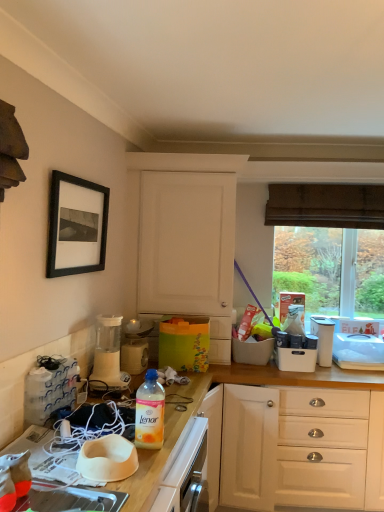
Question: Is black matte picture frame at upper left spatially inside translucent plastic bottle at lower center, or outside of it?

Choices:
 (A) inside
 (B) outside

Answer: (B)

Question: In the image, is black matte picture frame at upper left positioned in front of or behind translucent plastic bottle at lower center?

Choices:
 (A) behind
 (B) front

Answer: (A)

Question: Which object is the farthest from the white matte bowl at center?

Choices:
 (A) white plastic blender at center, acting as the second appliance starting from the right
 (B) translucent plastic bottle at lower center
 (C) matte white blender at left, placed as the 2th appliance when sorted from left to right
 (D) black matte picture frame at upper left
 (E) white plastic container at upper right, which ranks as the fourth appliance in left-to-right order

Answer: (E)

Question: Estimate the real-world distances between objects in this image. Which object is farther from the translucent plastic bottle at lower center?

Choices:
 (A) white matte bowl at center
 (B) white plastic container at upper right, which ranks as the fourth appliance in left-to-right order
 (C) matte white blender at left, placed as the 3th appliance when sorted from right to left
 (D) white plastic bag at left, the 1th appliance when ordered from front to back
 (E) black matte picture frame at upper left

Answer: (B)